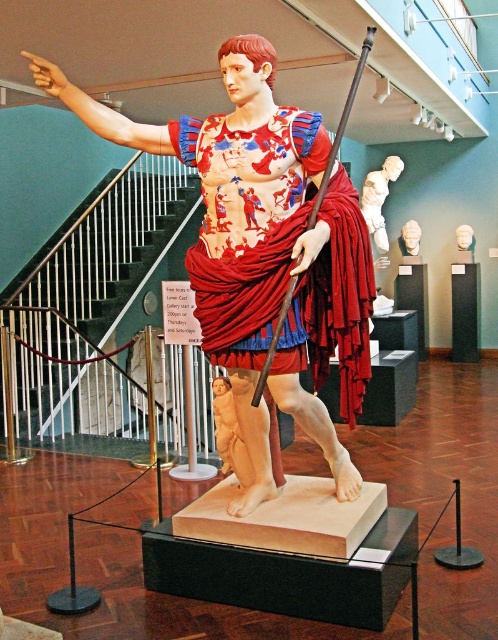
You are an art student observing the museum scene. You notice the white marble statue at center and the white marble mask at upper center. Which object is positioned higher in the image?

The white marble statue at center is positioned higher than the white marble mask at upper center according to the description.

You are standing in the museum and see two points marked on the statue. The first point is at coordinate point(232, 348) and the second is at point(409, 246). Which point is closer to you?

Point(232, 348) is closer to the viewer than point(409, 246).